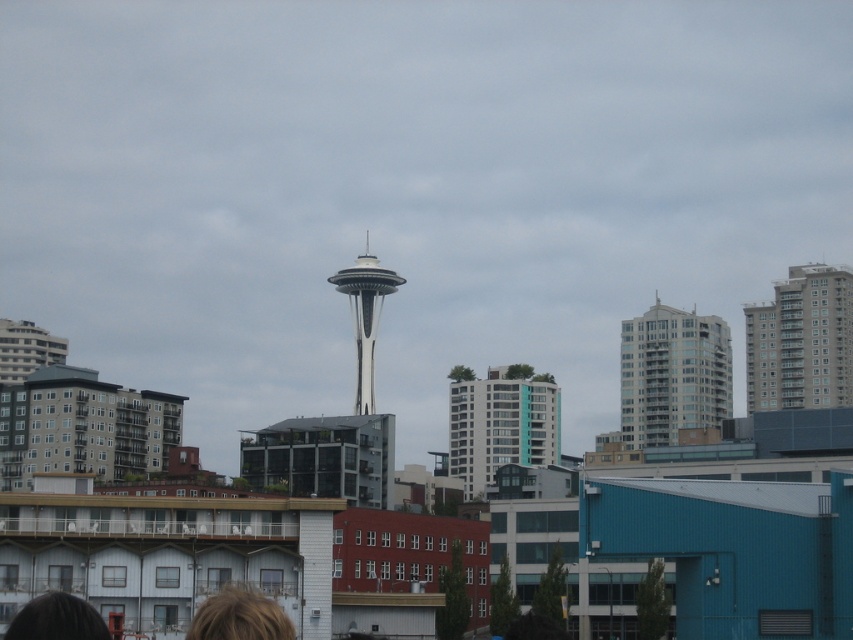
You are standing in the city and see two points in the scene. The first point is labeled as point [780,284] and the second is point [622,358]. Which point is closer to you?

Point [780,284] is closer to the viewer than point [622,358].

You are standing at the base of the glassy white building at center and want to see the top of the brown hair at lower center. Can you see it without any obstructions?

The glassy white building at center is much taller than the brown hair at lower center, so it would likely block your view of the brown hair at lower center.